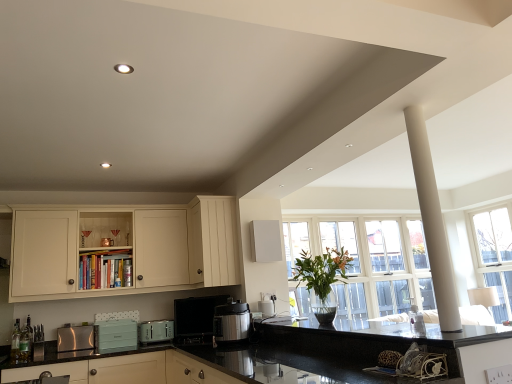
What is the approximate width of metallic silver can at upper left, the first bottle positioned from the top?

5.89 centimeters.

Describe the element at coordinates (75, 338) in the screenshot. I see `metallic silver toaster at lower left, acting as the 4th appliance starting from the right` at that location.

Where is `black glossy countertop at center, the 1th countertop positioned from the right`? The height and width of the screenshot is (384, 512). black glossy countertop at center, the 1th countertop positioned from the right is located at coordinates (371, 333).

Can you confirm if black granite countertop at center, acting as the second countertop starting from the right, is shorter than matte cream cabinet at upper center, acting as the third cabinetry starting from the bottom?

Correct, black granite countertop at center, acting as the second countertop starting from the right, is not as tall as matte cream cabinet at upper center, acting as the third cabinetry starting from the bottom.

From a real-world perspective, is black granite countertop at center, the 1th countertop when ordered from left to right, beneath matte cream cabinet at upper center, placed as the 1th cabinetry when sorted from top to bottom?

Yes.

From the image's perspective, between black granite countertop at center, the 1th countertop when ordered from left to right, and matte cream cabinet at upper center, acting as the third cabinetry starting from the bottom, which one is located above?

matte cream cabinet at upper center, acting as the third cabinetry starting from the bottom, is shown above in the image.

Is black granite countertop at center, acting as the second countertop starting from the right, to the right of matte cream cabinet at upper center, placed as the 1th cabinetry when sorted from top to bottom, from the viewer's perspective?

No, black granite countertop at center, acting as the second countertop starting from the right, is not to the right of matte cream cabinet at upper center, placed as the 1th cabinetry when sorted from top to bottom.

Are white smooth column at upper right and black granite countertop at center, acting as the second countertop starting from the right, far apart?

Yes, white smooth column at upper right and black granite countertop at center, acting as the second countertop starting from the right, are quite far apart.

Who is taller, white smooth column at upper right or black granite countertop at center, the 1th countertop when ordered from left to right?

Standing taller between the two is white smooth column at upper right.

Does point (421, 188) lie behind point (143, 348)?

No, (421, 188) is closer to viewer.

Considering the positions of objects white smooth column at upper right and black granite countertop at center, acting as the second countertop starting from the right, in the image provided, who is more to the left, white smooth column at upper right or black granite countertop at center, acting as the second countertop starting from the right,?

black granite countertop at center, acting as the second countertop starting from the right.

Is metallic silver coffee maker at center, which is counted as the 1th appliance, starting from the right, smaller than matte cream cabinets at lower center, the 3th cabinetry when ordered from top to bottom?

Yes, metallic silver coffee maker at center, which is counted as the 1th appliance, starting from the right, is smaller than matte cream cabinets at lower center, the 3th cabinetry when ordered from top to bottom.

Would you say metallic silver coffee maker at center, which is counted as the 1th appliance, starting from the right, is to the left or to the right of matte cream cabinets at lower center, the 3th cabinetry when ordered from top to bottom, in the picture?

From the image, it's evident that metallic silver coffee maker at center, which is counted as the 1th appliance, starting from the right, is to the right of matte cream cabinets at lower center, the 3th cabinetry when ordered from top to bottom.

From the image's perspective, would you say metallic silver coffee maker at center, positioned as the 4th appliance in left-to-right order, is positioned over matte cream cabinets at lower center, placed as the 1th cabinetry when sorted from bottom to top?

Yes, from the image's perspective, metallic silver coffee maker at center, positioned as the 4th appliance in left-to-right order, is over matte cream cabinets at lower center, placed as the 1th cabinetry when sorted from bottom to top.

In terms of width, does metallic silver coffee maker at center, which is counted as the 1th appliance, starting from the right, look wider or thinner when compared to matte cream cabinets at lower center, the 3th cabinetry when ordered from top to bottom?

In the image, metallic silver coffee maker at center, which is counted as the 1th appliance, starting from the right, appears to be more narrow than matte cream cabinets at lower center, the 3th cabinetry when ordered from top to bottom.

Looking at this image, from the image's perspective, does black granite countertop at center, acting as the second countertop starting from the right, appear lower than matte cream cabinets at lower center, placed as the 1th cabinetry when sorted from bottom to top?

Incorrect, from the image's perspective, black granite countertop at center, acting as the second countertop starting from the right, is higher than matte cream cabinets at lower center, placed as the 1th cabinetry when sorted from bottom to top.

From the image's perspective, which countertop is the 1st one above the matte cream cabinets at lower center, the 3th cabinetry when ordered from top to bottom? Please provide its 2D coordinates.

[(286, 356)]

Considering the relative sizes of black granite countertop at center, acting as the second countertop starting from the right, and matte cream cabinets at lower center, placed as the 1th cabinetry when sorted from bottom to top, in the image provided, is black granite countertop at center, acting as the second countertop starting from the right, taller than matte cream cabinets at lower center, placed as the 1th cabinetry when sorted from bottom to top,?

Yes, black granite countertop at center, acting as the second countertop starting from the right, is taller than matte cream cabinets at lower center, placed as the 1th cabinetry when sorted from bottom to top.

Which object is closer to the camera taking this photo, black granite countertop at center, the 1th countertop when ordered from left to right, or matte cream cabinets at lower center, the 3th cabinetry when ordered from top to bottom?

black granite countertop at center, the 1th countertop when ordered from left to right, is closer to the camera.

Which object is wider, cream matte cabinet at upper left, which is counted as the second cabinetry, starting from the top, or translucent glass bottle at lower left, which ranks as the second bottle in bottom-to-top order?

cream matte cabinet at upper left, which is counted as the second cabinetry, starting from the top.

Can you tell me how much cream matte cabinet at upper left, which is counted as the second cabinetry, starting from the bottom, and translucent glass bottle at lower left, positioned as the first bottle in front-to-back order, differ in facing direction?

The facing directions of cream matte cabinet at upper left, which is counted as the second cabinetry, starting from the bottom, and translucent glass bottle at lower left, positioned as the first bottle in front-to-back order, are 2.56 degrees apart.

Based on the photo, is cream matte cabinet at upper left, which is counted as the second cabinetry, starting from the top, taller than translucent glass bottle at lower left, the third bottle positioned from the right?

Yes, cream matte cabinet at upper left, which is counted as the second cabinetry, starting from the top, is taller than translucent glass bottle at lower left, the third bottle positioned from the right.

Consider the image. Is cream matte cabinet at upper left, which is counted as the second cabinetry, starting from the top, situated inside translucent glass bottle at lower left, arranged as the third bottle when viewed from the back, or outside?

cream matte cabinet at upper left, which is counted as the second cabinetry, starting from the top, is spatially situated outside translucent glass bottle at lower left, arranged as the third bottle when viewed from the back.

Is green glass bottle at lower left, the second bottle viewed from the front, positioned with its back to white smooth column at upper right?

No, green glass bottle at lower left, the second bottle viewed from the front, is not facing the opposite direction of white smooth column at upper right.

Relative to white smooth column at upper right, is green glass bottle at lower left, which is counted as the second bottle, starting from the back, in front or behind?

Clearly, green glass bottle at lower left, which is counted as the second bottle, starting from the back, is behind white smooth column at upper right.

How many degrees apart are the facing directions of green glass bottle at lower left, positioned as the second bottle in left-to-right order, and white smooth column at upper right?

92.5 degrees separate the facing orientations of green glass bottle at lower left, positioned as the second bottle in left-to-right order, and white smooth column at upper right.

Is point (29, 354) closer or farther from the camera than point (426, 229)?

Point (29, 354) appears to be farther away from the viewer than point (426, 229).

Are metallic silver pressure cooker at center and clear glass window at upper right making contact?

metallic silver pressure cooker at center and clear glass window at upper right are not in contact.

Is clear glass window at upper right completely or partially inside metallic silver pressure cooker at center?

No, metallic silver pressure cooker at center does not contain clear glass window at upper right.

Which object is more forward, metallic silver pressure cooker at center or clear glass window at upper right?

metallic silver pressure cooker at center is in front.

From a real-world perspective, does metallic silver pressure cooker at center sit lower than clear glass window at upper right?

Yes, from a real-world perspective, metallic silver pressure cooker at center is beneath clear glass window at upper right.

Identify the location of countertop that is the 2nd one when counting forward from the matte cream cabinet at upper center, acting as the third cabinetry starting from the bottom. (286, 356).

This screenshot has height=384, width=512. Identify the location of the 2nd countertop to the left when counting from the white smooth column at upper right. (286, 356).

Which object lies further to the anchor point black glossy countertop at center, the 1th countertop positioned from the right, matte cream cabinet at upper center, acting as the third cabinetry starting from the bottom, or metallic silver coffee maker at center, which is counted as the 1th appliance, starting from the right?

Based on the image, matte cream cabinet at upper center, acting as the third cabinetry starting from the bottom, appears to be further to black glossy countertop at center, the 1th countertop positioned from the right.

From the image, which object appears to be nearer to matte teal toaster at center, marked as the 3th appliance in a left-to-right arrangement, matte cream cabinet at upper center, placed as the 1th cabinetry when sorted from top to bottom, or black glossy countertop at center, which is counted as the second countertop, starting from the left?

matte cream cabinet at upper center, placed as the 1th cabinetry when sorted from top to bottom, is closer to matte teal toaster at center, marked as the 3th appliance in a left-to-right arrangement.

Estimate the real-world distances between objects in this image. Which object is closer to green glass bottle at lower left, the second bottle viewed from the front, matte cream cabinet at upper center, placed as the 1th cabinetry when sorted from top to bottom, or teal matte toaster at center, which is counted as the third appliance, starting from the right?

teal matte toaster at center, which is counted as the third appliance, starting from the right, is closer to green glass bottle at lower left, the second bottle viewed from the front.

Which object lies further to the anchor point translucent glass bottle at lower left, positioned as the first bottle in front-to-back order, matte cream cabinets at lower center, placed as the 1th cabinetry when sorted from bottom to top, or clear glass window at upper right?

The object further to translucent glass bottle at lower left, positioned as the first bottle in front-to-back order, is clear glass window at upper right.

Looking at the image, which one is located closer to cream matte cabinet at upper left, which is counted as the second cabinetry, starting from the bottom, green glass bottle at lower left, which ranks as the third bottle in top-to-bottom order, or white smooth column at upper right?

green glass bottle at lower left, which ranks as the third bottle in top-to-bottom order, is closer to cream matte cabinet at upper left, which is counted as the second cabinetry, starting from the bottom.

Estimate the real-world distances between objects in this image. Which object is further from metallic silver can at upper left, the first bottle positioned from the top, metallic silver pressure cooker at center or translucent glass bottle at lower left, which ranks as the second bottle in bottom-to-top order?

Based on the image, metallic silver pressure cooker at center appears to be further to metallic silver can at upper left, the first bottle positioned from the top.

Based on their spatial positions, is metallic silver can at upper left, the first bottle positioned from the top, or clear glass window at upper right closer to metallic silver pressure cooker at center?

metallic silver can at upper left, the first bottle positioned from the top, is closer to metallic silver pressure cooker at center.

Based on their spatial positions, is teal matte toaster at center, positioned as the 2th appliance in left-to-right order, or matte teal toaster at center, the second appliance when ordered from right to left, further from matte cream cabinets at lower center, placed as the 1th cabinetry when sorted from bottom to top?

matte teal toaster at center, the second appliance when ordered from right to left, lies further to matte cream cabinets at lower center, placed as the 1th cabinetry when sorted from bottom to top, than the other object.

The image size is (512, 384). In order to click on pillar between black granite countertop at center, the 1th countertop when ordered from left to right, and clear glass window at upper right in the front-back direction in this screenshot , I will do `click(432, 222)`.

You are a GUI agent. You are given a task and a screenshot of the screen. Output one action in this format:
    pyautogui.click(x=<x>, y=<y>)
    Task: Click on the kitchen appliance between metallic silver can at upper left, which is counted as the 3th bottle, starting from the bottom, and white smooth column at upper right
    The width and height of the screenshot is (512, 384).
    Given the screenshot: What is the action you would take?
    pyautogui.click(x=231, y=322)

What are the coordinates of `appliance between matte teal toaster at center, marked as the 3th appliance in a left-to-right arrangement, and clear glass window at upper right, in the horizontal direction` in the screenshot? It's located at (195, 319).

At what (x,y) coordinates should I click in order to perform the action: click on kitchen appliance between matte cream cabinets at lower center, placed as the 1th cabinetry when sorted from bottom to top, and clear glass window at upper right. Please return your answer as a coordinate pair (x, y). Looking at the image, I should click on (231, 322).